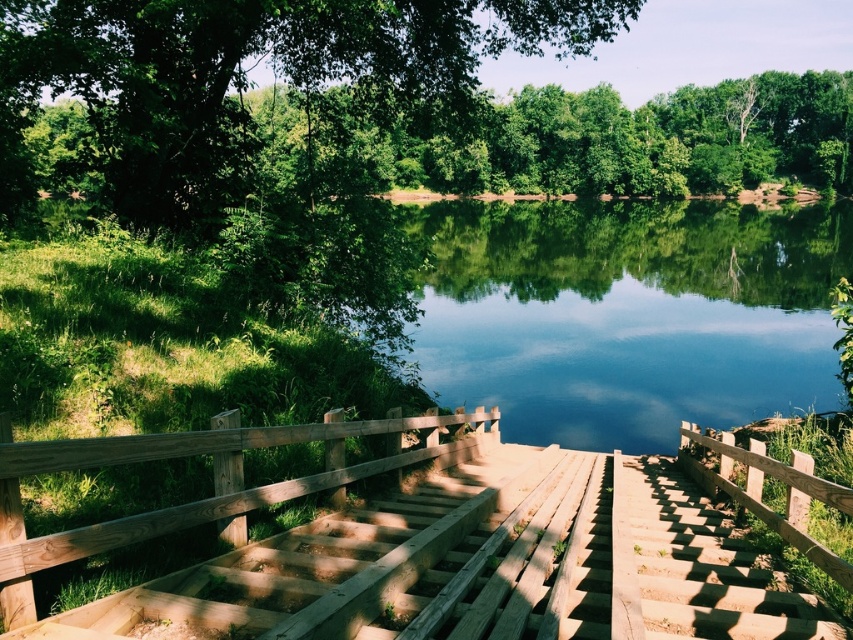
Question: Is the position of green smooth water at center less distant than that of wooden stairs at center?

Choices:
 (A) no
 (B) yes

Answer: (A)

Question: Estimate the real-world distances between objects in this image. Which object is closer to the wooden bridge at center?

Choices:
 (A) wooden rail at center
 (B) green smooth water at center
 (C) green leafy tree at upper center
 (D) wooden stairs at center

Answer: (D)

Question: Observing the image, what is the correct spatial positioning of wooden bridge at center in reference to wooden rail at center?

Choices:
 (A) right
 (B) left

Answer: (B)

Question: Does wooden bridge at center have a greater width compared to green leafy tree at upper center?

Choices:
 (A) yes
 (B) no

Answer: (B)

Question: Considering the real-world distances, which object is farthest from the green leafy tree at upper center?

Choices:
 (A) wooden stairs at center
 (B) green smooth water at center
 (C) wooden rail at center

Answer: (B)

Question: Which object is the farthest from the wooden bridge at center?

Choices:
 (A) green smooth water at center
 (B) green leafy tree at upper center

Answer: (A)